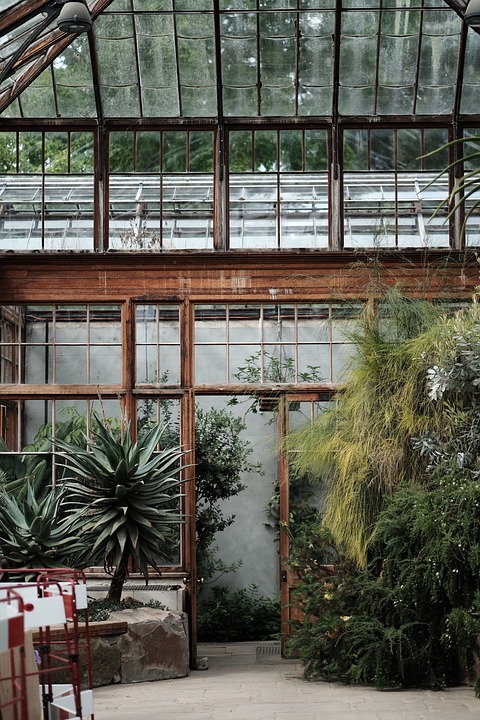
You are a GUI agent. You are given a task and a screenshot of the screen. Output one action in this format:
    pyautogui.click(x=<x>, y=<y>)
    Task: Click on the door handle
    The image size is (480, 720).
    Given the screenshot: What is the action you would take?
    pyautogui.click(x=185, y=580), pyautogui.click(x=205, y=580)